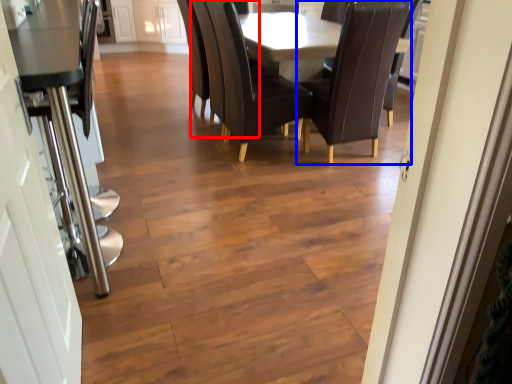
Question: Which object is closer to the camera taking this photo, armchair (highlighted by a red box) or chair (highlighted by a blue box)?

Choices:
 (A) armchair
 (B) chair

Answer: (B)